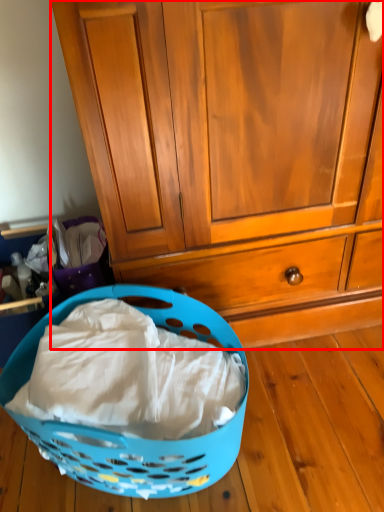
Question: Where is cabinetry (annotated by the red box) located in relation to picnic basket in the image?

Choices:
 (A) right
 (B) left

Answer: (A)